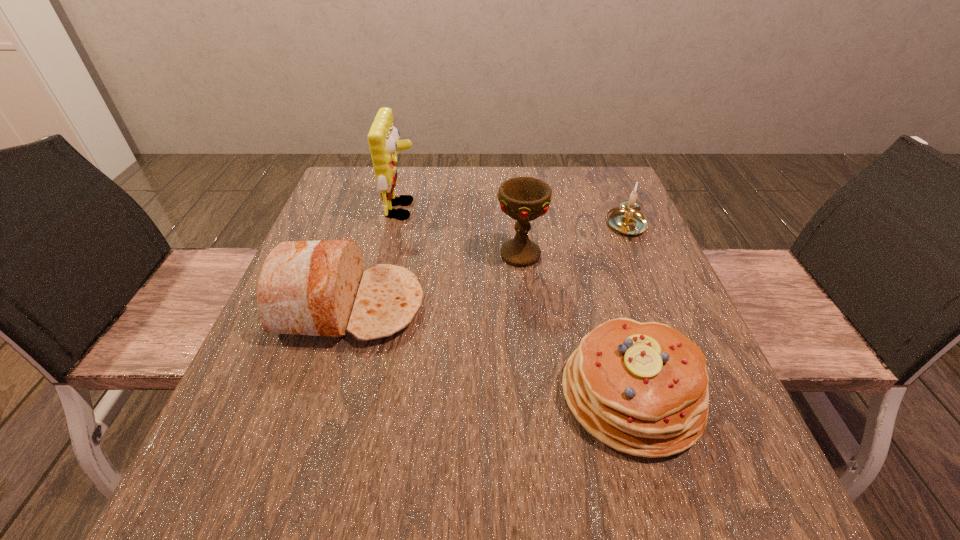
The height and width of the screenshot is (540, 960). I want to click on free space between the bread and the second tallest object, so click(436, 280).

The image size is (960, 540). I want to click on blank region between the sponge and the pancake, so click(517, 302).

Where is `empty space between the sponge and the pancake`? empty space between the sponge and the pancake is located at coordinates (517, 302).

Locate an element on the screen. The width and height of the screenshot is (960, 540). object that ranks as the closest to the pancake is located at coordinates (524, 199).

Identify the location of object that is the fourth closest one to the sponge. The width and height of the screenshot is (960, 540). (626, 219).

Locate an element on the screen. vacant point that satisfies the following two spatial constraints: 1. on the face of the tallest object; 2. on the back side of the pancake is located at coordinates [x=360, y=394].

Where is `blank area in the image that satisfies the following two spatial constraints: 1. on the face of the sponge; 2. on the back side of the chalice`? This screenshot has height=540, width=960. blank area in the image that satisfies the following two spatial constraints: 1. on the face of the sponge; 2. on the back side of the chalice is located at coordinates click(x=393, y=255).

This screenshot has width=960, height=540. I want to click on vacant space that satisfies the following two spatial constraints: 1. on the face of the tallest object; 2. on the back side of the pancake, so click(x=360, y=394).

At what (x,y) coordinates should I click in order to perform the action: click on vacant area in the image that satisfies the following two spatial constraints: 1. on the face of the tallest object; 2. on the right side of the fourth shortest object. Please return your answer as a coordinate pair (x, y). This screenshot has width=960, height=540. Looking at the image, I should click on (393, 255).

The height and width of the screenshot is (540, 960). I want to click on free point that satisfies the following two spatial constraints: 1. at the sliced end of the pancake; 2. on the right side of the bread, so click(x=324, y=394).